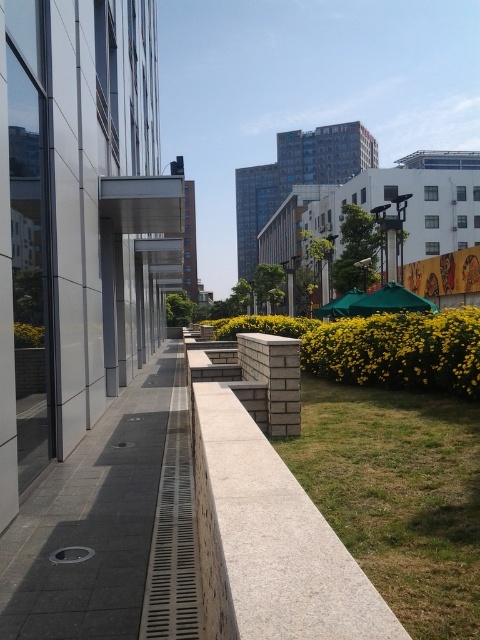
You are standing at the point marked as point (x=398, y=496) in the image. Looking around, you see the contemporary building with large glass windows to your left and the paved walkway extending ahead of you. Which direction should you walk to reach the green grass at lower right?

The point (x=398, y=496) corresponds to the green grass at lower right, so you are already standing on the green grass at lower right. No need to move further.

You are a delivery person trying to navigate through the urban area shown. You need to place a heavy box on the gray stone ledge at center. However, there is a gray concrete pavement at center nearby. Which surface is closer to you as you approach the scene from the front?

The gray stone ledge at center is closer to you because the gray concrete pavement at center is positioned behind it.

You are a delivery person trying to find the entrance to the building. You see the green grass at lower right and the gray concrete pavement at center. Which direction should you walk towards to reach the building entrance?

You should walk towards the gray concrete pavement at center because the green grass at lower right is positioned to its right side, meaning the pavement is closer to the building entrance.